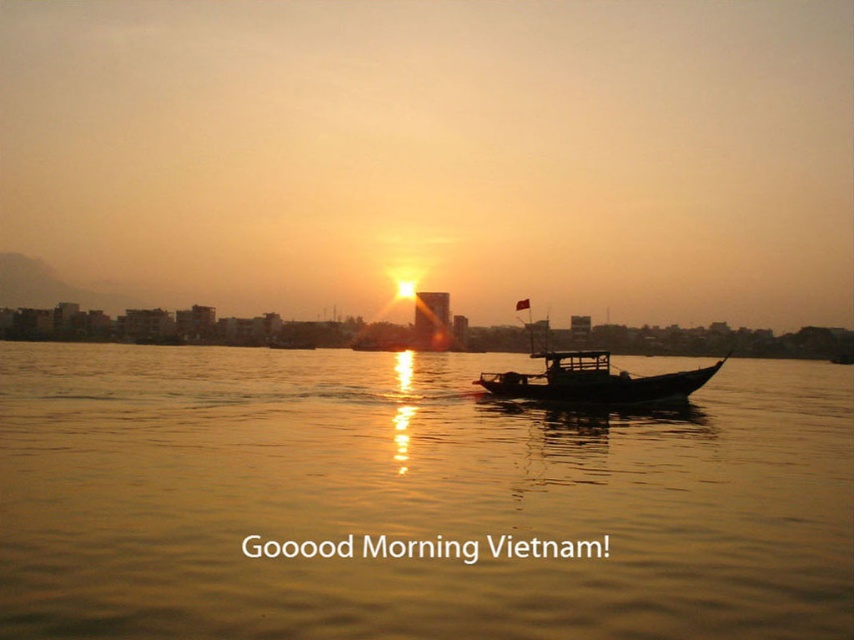
You are standing at the edge of the water in the sunset scene. You see two points marked on the image. Which point is closer to you, point 1 at coordinates point (820, 388) or point 2 at coordinates point (594, 385)?

Point 1 at coordinates point (820, 388) is further to the viewer than point 2 at coordinates point (594, 385), so point 2 is closer to you.

You are an observer standing on the shore looking at the golden reflective water at center and the wooden boat at center. Which object is closer to the horizon?

The wooden boat at center is closer to the horizon because the golden reflective water at center is located below it, meaning the boat is positioned in front of the water from the observer perspective.